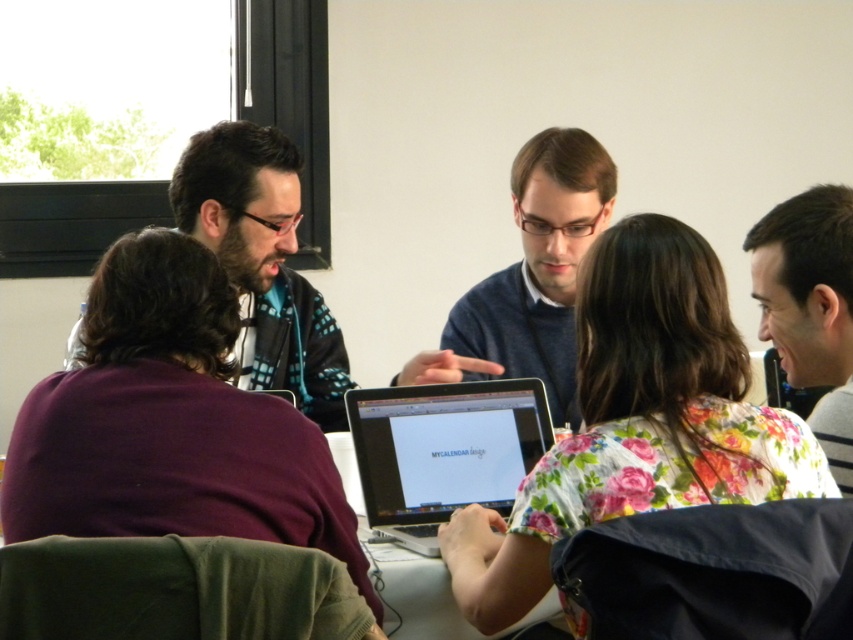
Is point (451, 445) less distant than point (543, 608)?

That is False.

Does silver metallic laptop at center have a larger size compared to white glossy table at center?

Actually, silver metallic laptop at center might be smaller than white glossy table at center.

Where is `silver metallic laptop at center`? The width and height of the screenshot is (853, 640). silver metallic laptop at center is located at coordinates (444, 451).

Does point (595, 184) come closer to viewer compared to point (379, 564)?

No, (595, 184) is further to viewer.

Is blue sweater at center above white glossy table at center?

Indeed, blue sweater at center is positioned over white glossy table at center.

Identify the location of blue sweater at center. The image size is (853, 640). (538, 268).

Is point (187, 195) more distant than point (386, 493)?

That is True.

Can you confirm if dark blue sweater at upper left is positioned above silver metallic laptop at center?

Yes.

The width and height of the screenshot is (853, 640). In order to click on dark blue sweater at upper left in this screenshot , I will do `click(263, 262)`.